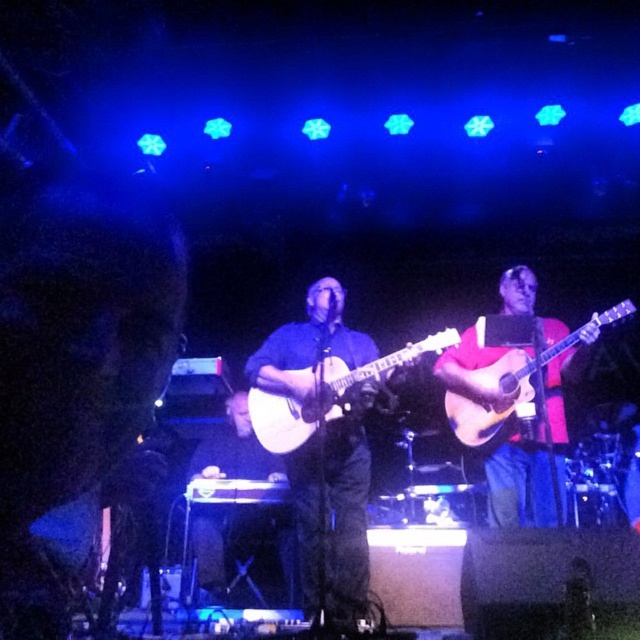
Find the location of `white matte acoustic guitar at center`. white matte acoustic guitar at center is located at coordinates (324, 394).

Which is below, white matte acoustic guitar at center or light brown acoustic guitar at center?

white matte acoustic guitar at center is lower down.

Is point (330, 410) positioned in front of point (468, 419)?

Yes, point (330, 410) is closer to viewer.

What are the coordinates of `white matte acoustic guitar at center` in the screenshot? It's located at (324, 394).

Can you confirm if matte wood guitar at center is positioned above white matte acoustic guitar at center?

Actually, matte wood guitar at center is below white matte acoustic guitar at center.

In the scene shown: Between matte wood guitar at center and white matte acoustic guitar at center, which one is positioned higher?

white matte acoustic guitar at center is above.

What do you see at coordinates (234, 449) in the screenshot?
I see `matte wood guitar at center` at bounding box center [234, 449].

The height and width of the screenshot is (640, 640). I want to click on matte wood guitar at center, so click(234, 449).

Does matte blue guitar at center appear on the right side of matte wood guitar at center?

Indeed, matte blue guitar at center is positioned on the right side of matte wood guitar at center.

Can you confirm if matte blue guitar at center is wider than matte wood guitar at center?

Indeed, matte blue guitar at center has a greater width compared to matte wood guitar at center.

Is point (353, 547) in front of point (211, 467)?

That is True.

You are a GUI agent. You are given a task and a screenshot of the screen. Output one action in this format:
    pyautogui.click(x=<x>, y=<y>)
    Task: Click on the matte blue guitar at center
    The width and height of the screenshot is (640, 640).
    Given the screenshot: What is the action you would take?
    pyautogui.click(x=333, y=512)